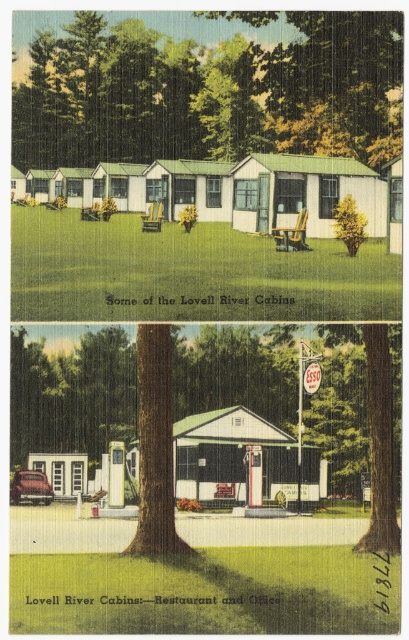
Question: Does green textured tree at center appear over green leafy tree at upper center?

Choices:
 (A) no
 (B) yes

Answer: (A)

Question: Which point is closer to the camera?

Choices:
 (A) (71, 456)
 (B) (337, 64)

Answer: (B)

Question: Does green textured tree at center appear on the right side of green leafy tree at upper center?

Choices:
 (A) no
 (B) yes

Answer: (A)

Question: From the image, what is the correct spatial relationship of green textured tree at center in relation to green leafy tree at upper center?

Choices:
 (A) right
 (B) left

Answer: (B)